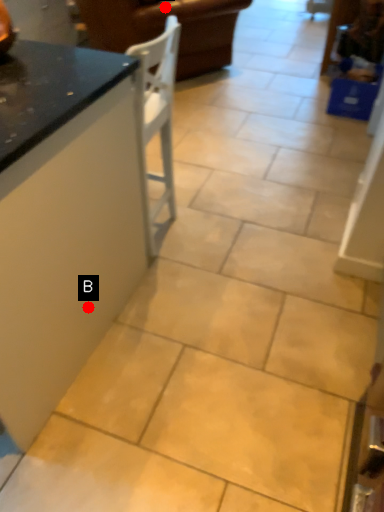
Question: Two points are circled on the image, labeled by A and B beside each circle. Which point is farther to the camera?

Choices:
 (A) A is further
 (B) B is further

Answer: (A)